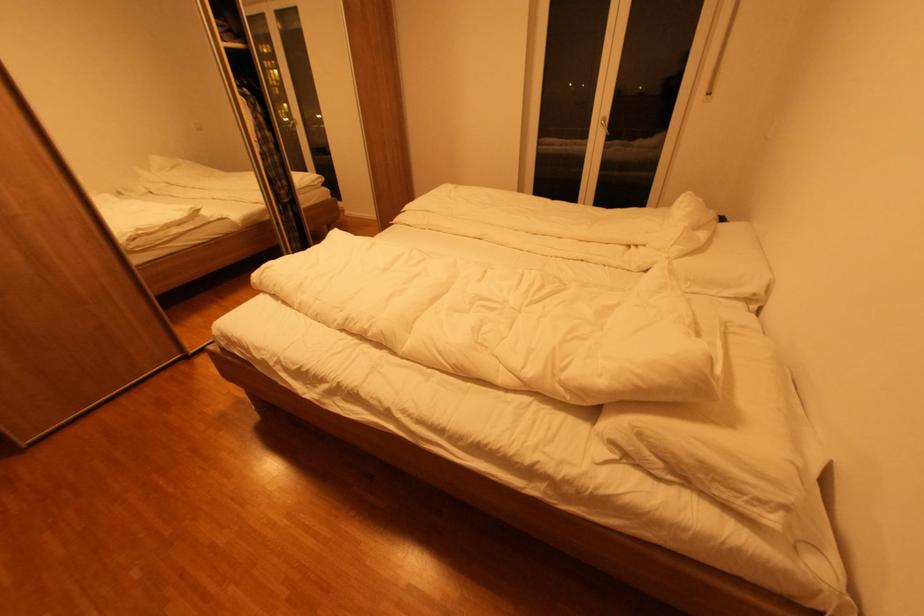
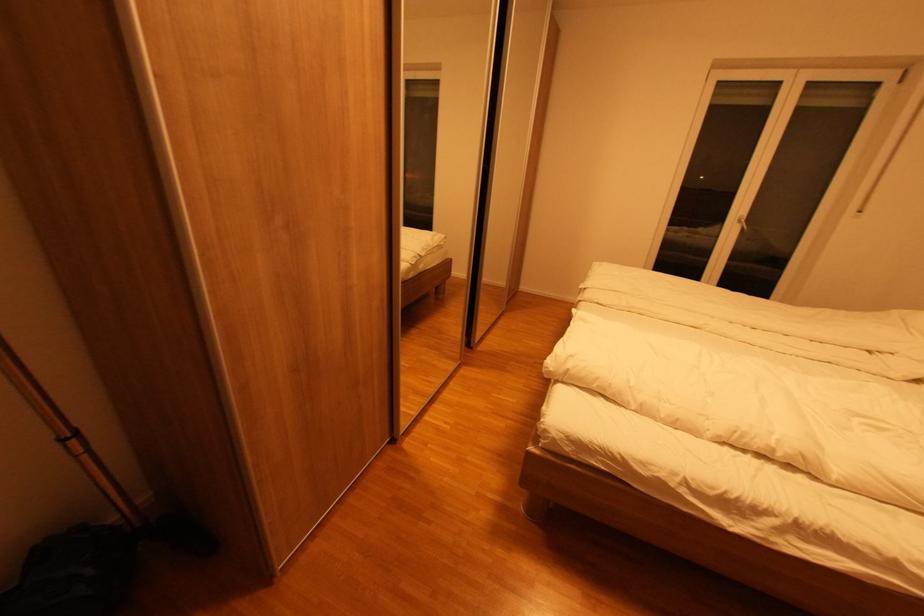
The point at (x=608, y=118) is marked in the first image. Where is the corresponding point in the second image?

(744, 216)